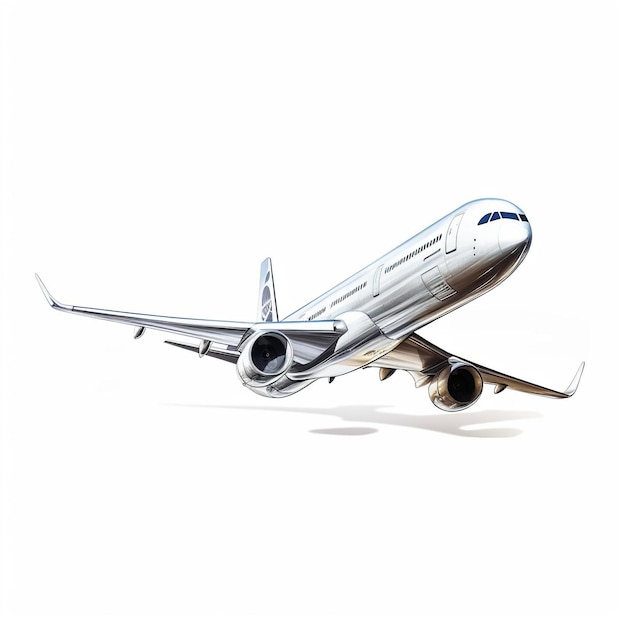
This screenshot has width=626, height=626. In order to click on door in this screenshot , I will do `click(453, 232)`.